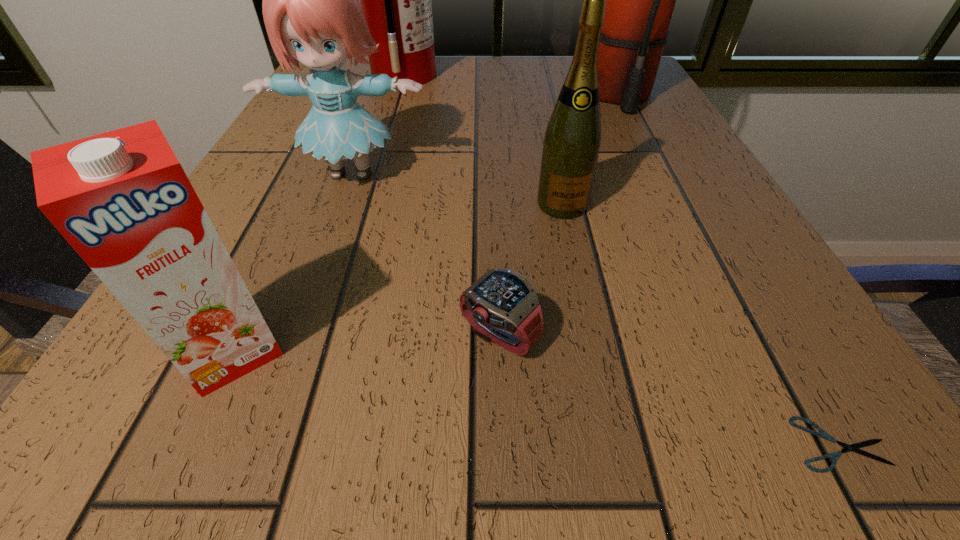
Locate an element on the screen. The height and width of the screenshot is (540, 960). the left fire extinguisher is located at coordinates [395, 0].

Image resolution: width=960 pixels, height=540 pixels. Identify the location of the right fire extinguisher. tap(640, 0).

Locate an element on the screen. This screenshot has width=960, height=540. doll is located at coordinates (312, 15).

Where is `wine bottle`? wine bottle is located at coordinates (572, 139).

I want to click on carton, so click(x=122, y=200).

In order to click on the fourth object from left to right in this screenshot , I will do `click(502, 306)`.

The height and width of the screenshot is (540, 960). I want to click on the second shortest object, so click(x=502, y=306).

Locate an element on the screen. This screenshot has width=960, height=540. the nearest object is located at coordinates (834, 456).

Image resolution: width=960 pixels, height=540 pixels. I want to click on the shortest object, so click(834, 456).

The image size is (960, 540). Find the location of `vacant space positioned at the nozzle of the left fire extinguisher`. vacant space positioned at the nozzle of the left fire extinguisher is located at coordinates (553, 75).